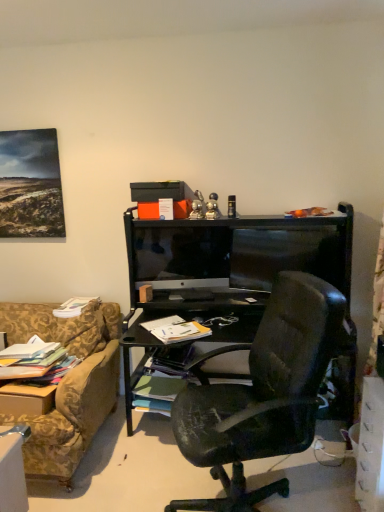
Locate an element on the screen. This screenshot has width=384, height=512. white plastic drawer at lower right is located at coordinates (371, 447).

Where is `black glossy monitor at center`? black glossy monitor at center is located at coordinates (182, 257).

In order to click on matte black box at upper center in this screenshot , I will do pyautogui.click(x=160, y=191).

The height and width of the screenshot is (512, 384). Identify the location of multicolored paper stack at left, which ranks as the third book in top-to-bottom order. (37, 362).

In order to face multicolored paper stack at left, marked as the first book in a left-to-right arrangement, should I rotate leftwards or rightwards?

Rotate left and turn 21.282 degrees.

The image size is (384, 512). Find the location of `white plastic drawer at lower right`. white plastic drawer at lower right is located at coordinates (371, 447).

In the scene shown: From the image's perspective, between black glossy monitor at center and white paper at center, placed as the 4th book when sorted from left to right, which one is located above?

From the image's view, black glossy monitor at center is above.

I want to click on television behind the white paper at center, which is counted as the 2th book, starting from the top, so click(182, 257).

Would you consider black glossy monitor at center to be distant from white paper at center, positioned as the first book in right-to-left order?

Actually, black glossy monitor at center and white paper at center, positioned as the first book in right-to-left order, are a little close together.

Can you confirm if white plastic drawer at lower right is thinner than green matte book at center, which appears as the 4th book when viewed from the top?

Yes, white plastic drawer at lower right is thinner than green matte book at center, which appears as the 4th book when viewed from the top.

Can you confirm if white plastic drawer at lower right is positioned to the left of green matte book at center, which appears as the 4th book when viewed from the top?

Incorrect, white plastic drawer at lower right is not on the left side of green matte book at center, which appears as the 4th book when viewed from the top.

Measure the distance between white plastic drawer at lower right and green matte book at center, which ranks as the 2th book in right-to-left order.

white plastic drawer at lower right and green matte book at center, which ranks as the 2th book in right-to-left order, are 3.90 feet apart.

Considering the relative sizes of white plastic drawer at lower right and green matte book at center, which appears as the third book when viewed from the left, in the image provided, is white plastic drawer at lower right taller than green matte book at center, which appears as the third book when viewed from the left,?

Yes, white plastic drawer at lower right is taller than green matte book at center, which appears as the third book when viewed from the left.

Consider the image. From a real-world perspective, which object rests below the other?

In real-world perspective, green matte book at center, acting as the 1th book starting from the bottom, is lower.

Is green matte book at center, which appears as the third book when viewed from the left, in front of or behind multicolored paper stack at left, marked as the first book in a left-to-right arrangement, in the image?

green matte book at center, which appears as the third book when viewed from the left, is positioned farther from the viewer than multicolored paper stack at left, marked as the first book in a left-to-right arrangement.

This screenshot has width=384, height=512. In order to click on the 2nd book to the left of the green matte book at center, which ranks as the 2th book in right-to-left order, starting your count from the anchor in this screenshot , I will do `click(37, 362)`.

Is green matte book at center, which appears as the third book when viewed from the left, at the right side of multicolored paper stack at left, marked as the first book in a left-to-right arrangement?

Correct, you'll find green matte book at center, which appears as the third book when viewed from the left, to the right of multicolored paper stack at left, marked as the first book in a left-to-right arrangement.

How many degrees apart are the facing directions of white paper book at lower left, which appears as the third book when viewed from the right, and white paper at center, positioned as the first book in right-to-left order?

The angle between the facing direction of white paper book at lower left, which appears as the third book when viewed from the right, and the facing direction of white paper at center, positioned as the first book in right-to-left order, is 39.1 degrees.

From a real-world perspective, which object rests below the other?

In real-world perspective, white paper at center, which is counted as the 2th book, starting from the top, is lower.

Considering the sizes of objects white paper book at lower left, the 2th book viewed from the left, and white paper at center, which is counted as the 2th book, starting from the top, in the image provided, who is bigger, white paper book at lower left, the 2th book viewed from the left, or white paper at center, which is counted as the 2th book, starting from the top,?

Bigger between the two is white paper book at lower left, the 2th book viewed from the left.

Considering the positions of objects white paper book at lower left, the fourth book when ordered from bottom to top, and white paper at center, the 3th book positioned from the bottom, in the image provided, who is more to the right, white paper book at lower left, the fourth book when ordered from bottom to top, or white paper at center, the 3th book positioned from the bottom,?

Positioned to the right is white paper at center, the 3th book positioned from the bottom.

Considering the positions of point (163, 386) and point (170, 244), is point (163, 386) closer or farther from the camera than point (170, 244)?

Point (163, 386) is positioned closer to the camera compared to point (170, 244).

Is green matte book at center, which appears as the third book when viewed from the left, directly adjacent to black glossy monitor at center?

No, green matte book at center, which appears as the third book when viewed from the left, is not beside black glossy monitor at center.

From the image's perspective, is green matte book at center, which ranks as the 2th book in right-to-left order, below black glossy monitor at center?

Yes, from the image's perspective, green matte book at center, which ranks as the 2th book in right-to-left order, is beneath black glossy monitor at center.

Which is closer to the camera, (62, 362) or (138, 385)?

Point (62, 362).

Could you measure the distance between multicolored paper stack at left, which ranks as the third book in top-to-bottom order, and green matte book at center, which appears as the 4th book when viewed from the top?

24.43 inches.

Is multicolored paper stack at left, acting as the 2th book starting from the bottom, wider or thinner than green matte book at center, which appears as the third book when viewed from the left?

In the image, multicolored paper stack at left, acting as the 2th book starting from the bottom, appears to be wider than green matte book at center, which appears as the third book when viewed from the left.

What are the coordinates of `book that is the 2nd object located in front of the green matte book at center, which appears as the 4th book when viewed from the top` in the screenshot? It's located at click(x=37, y=362).

From a real-world perspective, which object stands above the other?

From a 3D spatial view, white plastic drawer at lower right is above.

Is green matte book at center, which ranks as the 2th book in right-to-left order, oriented away from white plastic drawer at lower right?

No, white plastic drawer at lower right is not at the back of green matte book at center, which ranks as the 2th book in right-to-left order.

How many degrees apart are the facing directions of green matte book at center, acting as the 1th book starting from the bottom, and white plastic drawer at lower right?

There is a 85.1-degree angle between the facing directions of green matte book at center, acting as the 1th book starting from the bottom, and white plastic drawer at lower right.

From the picture: Could you measure the distance between green matte book at center, which ranks as the 2th book in right-to-left order, and white plastic drawer at lower right?

green matte book at center, which ranks as the 2th book in right-to-left order, and white plastic drawer at lower right are 1.19 meters apart.

At what (x,y) coordinates should I click in order to perform the action: click on television above the white paper at center, positioned as the first book in right-to-left order (from a real-world perspective). Please return your answer as a coordinate pair (x, y). This screenshot has width=384, height=512. Looking at the image, I should click on (182, 257).

The width and height of the screenshot is (384, 512). Find the location of `the 2nd book counting from the left side of the white plastic drawer at lower right`. the 2nd book counting from the left side of the white plastic drawer at lower right is located at coordinates (159, 387).

When comparing their distances from white paper book at lower left, positioned as the 1th book in top-to-bottom order, does matte black box at upper center or multicolored paper stack at left, marked as the first book in a left-to-right arrangement, seem closer?

multicolored paper stack at left, marked as the first book in a left-to-right arrangement.

From the image, which object appears to be farther from matte black box at upper center, green matte book at center, which appears as the 4th book when viewed from the top, or black glossy monitor at center?

Among the two, green matte book at center, which appears as the 4th book when viewed from the top, is located further to matte black box at upper center.

Based on their spatial positions, is green matte book at center, which appears as the third book when viewed from the left, or white paper book at lower left, the fourth book when ordered from bottom to top, closer to black glossy monitor at center?

Based on the image, white paper book at lower left, the fourth book when ordered from bottom to top, appears to be nearer to black glossy monitor at center.

Based on their spatial positions, is multicolored paper stack at left, marked as the first book in a left-to-right arrangement, or black glossy monitor at center closer to white plastic drawer at lower right?

The object closer to white plastic drawer at lower right is black glossy monitor at center.

From the image, which object appears to be nearer to white paper at center, positioned as the first book in right-to-left order, white plastic drawer at lower right or matte black box at upper center?

Based on the image, matte black box at upper center appears to be nearer to white paper at center, positioned as the first book in right-to-left order.

Considering their positions, is white paper book at lower left, which appears as the third book when viewed from the right, positioned further to multicolored paper stack at left, acting as the 2th book starting from the bottom, than matte black box at upper center?

matte black box at upper center.

From the image, which object appears to be farther from multicolored paper stack at left, which ranks as the third book in top-to-bottom order, white plastic drawer at lower right or matte black box at upper center?

Among the two, white plastic drawer at lower right is located further to multicolored paper stack at left, which ranks as the third book in top-to-bottom order.

From the image, which object appears to be nearer to white paper book at lower left, which appears as the third book when viewed from the right, green matte book at center, acting as the 1th book starting from the bottom, or matte black box at upper center?

green matte book at center, acting as the 1th book starting from the bottom.

Where is `box between white paper book at lower left, the 2th book viewed from the left, and white plastic drawer at lower right`? box between white paper book at lower left, the 2th book viewed from the left, and white plastic drawer at lower right is located at coordinates (160, 191).

Identify the location of box between multicolored paper stack at left, which is the 4th book from right to left, and white plastic drawer at lower right, in the horizontal direction. This screenshot has width=384, height=512. (160, 191).

Image resolution: width=384 pixels, height=512 pixels. Find the location of `book between green matte book at center, which ranks as the 2th book in right-to-left order, and white plastic drawer at lower right`. book between green matte book at center, which ranks as the 2th book in right-to-left order, and white plastic drawer at lower right is located at coordinates (176, 329).

You are a GUI agent. You are given a task and a screenshot of the screen. Output one action in this format:
    pyautogui.click(x=<x>, y=<y>)
    Task: Click on the television between multicolored paper stack at left, which is the 4th book from right to left, and white plastic drawer at lower right, in the horizontal direction
    
    Given the screenshot: What is the action you would take?
    pyautogui.click(x=182, y=257)